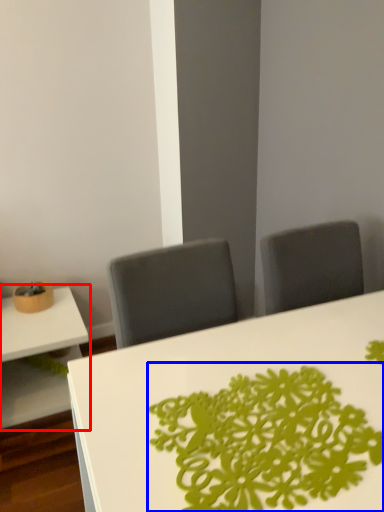
Question: Among these objects, which one is nearest to the camera, table (highlighted by a red box) or floral arrangement (highlighted by a blue box)?

Choices:
 (A) table
 (B) floral arrangement

Answer: (B)